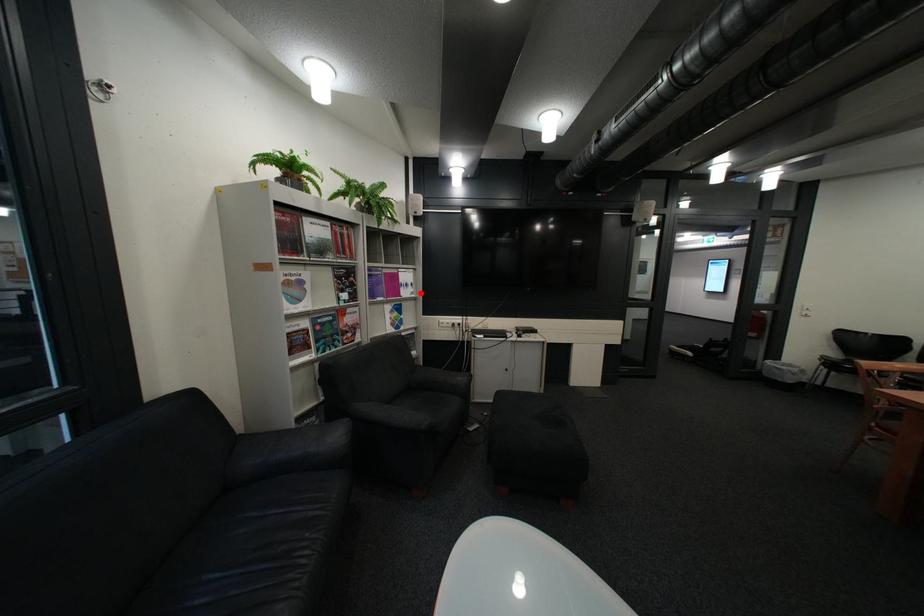
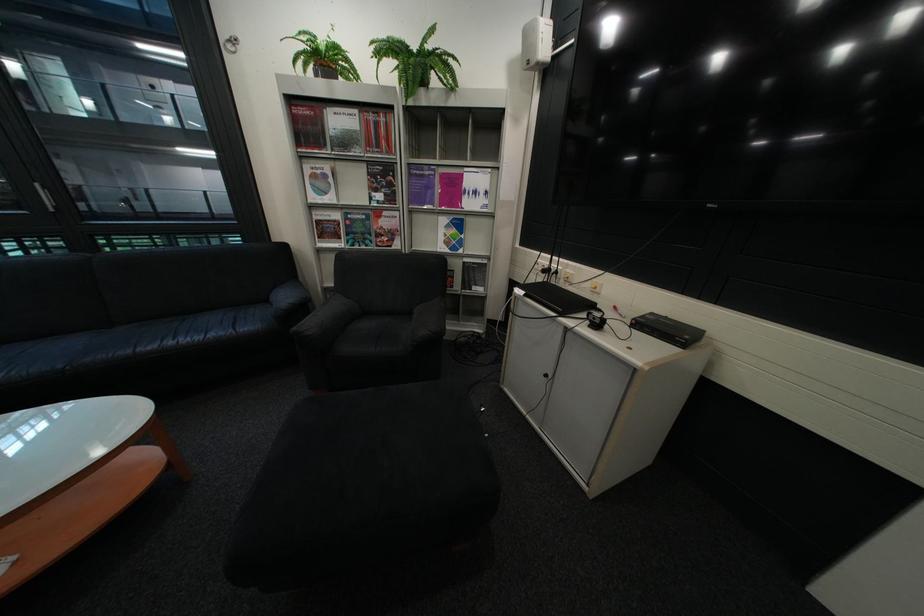
Locate, in the second image, the point that corresponds to the highlighted location in the first image.

(484, 204)